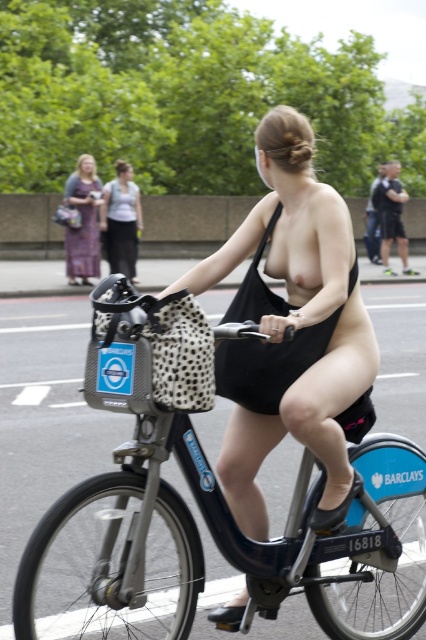
You are a photographer trying to capture the exact location of the black matte bikini top at center in the image. According to the coordinates provided, where would you focus your camera?

The black matte bikini top at center is located at coordinates point (268,365), so you should focus your camera there.

You are standing on the sidewalk and see the Barclays Cycle Hire bike with the number 16818. There is a point at coordinates (276, 609). Is this point closer to you than the bike?

The point at coordinates (276, 609) is 3.55 meters from the viewer, but the distance to the bike isn not provided. Therefore, I cannot determine if the point is closer than the bike.

Consider the image. You are a delivery person who needs to pass by the printed fabric dress at left. Can you safely move your delivery cart around the metallic blue bicycle at center without hitting it?

The metallic blue bicycle at center is positioned under the printed fabric dress at left, so the delivery cart can safely move around the bicycle by going around the sides or behind it since it is not blocking the path directly in front of the dress.